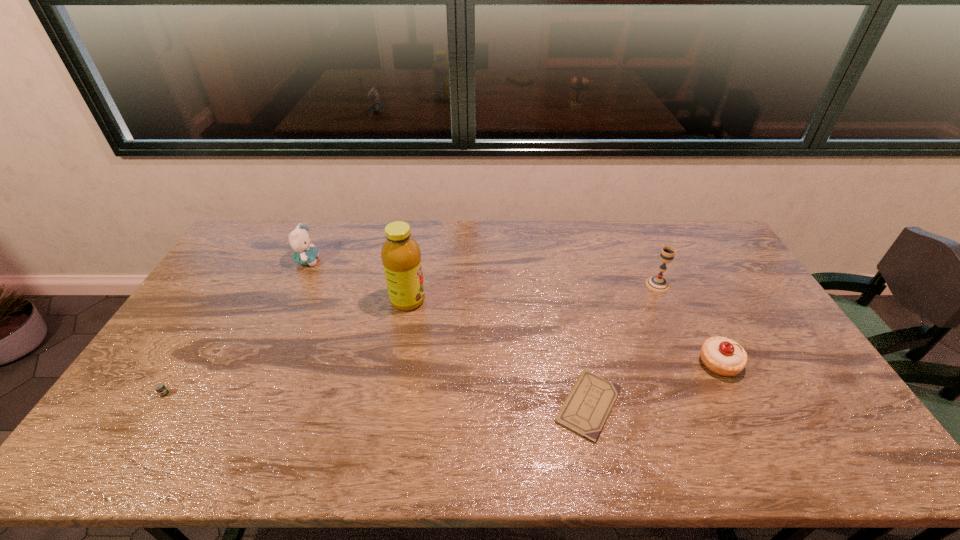
At what (x,y) coordinates should I click in order to perform the action: click on vacant space at the near edge. Please return your answer as a coordinate pair (x, y). Looking at the image, I should click on (184, 443).

Image resolution: width=960 pixels, height=540 pixels. In order to click on vacant region at the right edge of the desktop in this screenshot , I will do `click(697, 267)`.

You are a GUI agent. You are given a task and a screenshot of the screen. Output one action in this format:
    pyautogui.click(x=<x>, y=<y>)
    Task: Click on the vacant area between the chalice and the beer can
    
    Given the screenshot: What is the action you would take?
    pyautogui.click(x=411, y=339)

In order to click on vacant space that is in between the farthest object and the fourth object from right to left in this screenshot , I will do `click(357, 281)`.

The image size is (960, 540). I want to click on free spot between the second shortest object and the fourth object from left to right, so click(376, 400).

Locate an element on the screen. Image resolution: width=960 pixels, height=540 pixels. vacant space that is in between the tallest object and the shortest object is located at coordinates (498, 353).

This screenshot has width=960, height=540. I want to click on free spot between the leftmost object and the chalice, so click(x=411, y=339).

Where is `vacant space that is in between the beer can and the chalice`? This screenshot has width=960, height=540. vacant space that is in between the beer can and the chalice is located at coordinates (411, 339).

Locate an element on the screen. empty location between the fifth object from right to left and the third shortest object is located at coordinates coord(514,312).

At what (x,y) coordinates should I click in order to perform the action: click on free space between the farthest object and the chalice. Please return your answer as a coordinate pair (x, y). The width and height of the screenshot is (960, 540). Looking at the image, I should click on (482, 273).